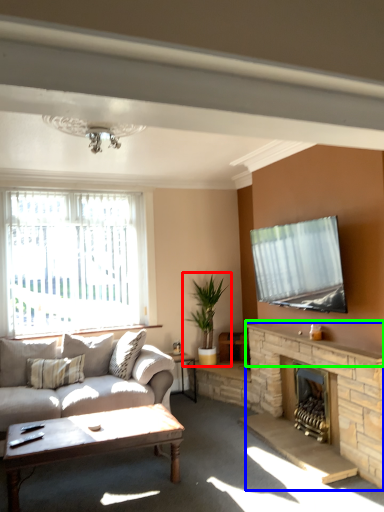
Question: Which is nearer to the houseplant (highlighted by a red box)? fireplace (highlighted by a blue box) or mantle (highlighted by a green box).

Choices:
 (A) fireplace
 (B) mantle

Answer: (B)